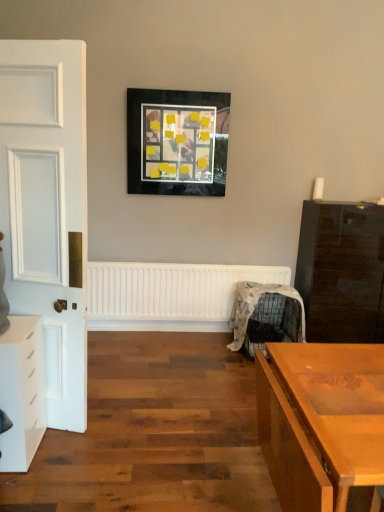
Question: From a real-world perspective, is glossy dark wood chest of drawers at right, which is counted as the second chest of drawers, starting from the front, over matte black picture frame at upper center?

Choices:
 (A) no
 (B) yes

Answer: (A)

Question: Is glossy dark wood chest of drawers at right, which ranks as the 1th chest of drawers in right-to-left order, facing towards matte black picture frame at upper center?

Choices:
 (A) yes
 (B) no

Answer: (B)

Question: Is glossy dark wood chest of drawers at right, which is the first chest of drawers from back to front, to the left of matte black picture frame at upper center from the viewer's perspective?

Choices:
 (A) no
 (B) yes

Answer: (A)

Question: Considering the relative sizes of glossy dark wood chest of drawers at right, which is counted as the second chest of drawers, starting from the front, and matte black picture frame at upper center in the image provided, is glossy dark wood chest of drawers at right, which is counted as the second chest of drawers, starting from the front, smaller than matte black picture frame at upper center?

Choices:
 (A) no
 (B) yes

Answer: (A)

Question: Can you confirm if glossy dark wood chest of drawers at right, which ranks as the 1th chest of drawers in right-to-left order, is bigger than matte black picture frame at upper center?

Choices:
 (A) no
 (B) yes

Answer: (B)

Question: In terms of height, does white matte chest of drawers at left, the first chest of drawers in the front-to-back sequence, look taller or shorter compared to white matte radiator at center?

Choices:
 (A) tall
 (B) short

Answer: (A)

Question: Would you say white matte chest of drawers at left, which is the first chest of drawers from left to right, is to the left or to the right of white matte radiator at center in the picture?

Choices:
 (A) right
 (B) left

Answer: (B)

Question: From a real-world perspective, is white matte chest of drawers at left, which is the first chest of drawers from left to right, positioned above or below white matte radiator at center?

Choices:
 (A) below
 (B) above

Answer: (A)

Question: Is white matte chest of drawers at left, which is the first chest of drawers from left to right, bigger or smaller than white matte radiator at center?

Choices:
 (A) small
 (B) big

Answer: (A)

Question: Is matte black picture frame at upper center taller or shorter than white matte chest of drawers at left, the second chest of drawers viewed from the right?

Choices:
 (A) tall
 (B) short

Answer: (A)

Question: Is point (165, 185) closer or farther from the camera than point (29, 358)?

Choices:
 (A) farther
 (B) closer

Answer: (A)

Question: Relative to white matte chest of drawers at left, the first chest of drawers in the front-to-back sequence, is matte black picture frame at upper center in front or behind?

Choices:
 (A) front
 (B) behind

Answer: (B)

Question: From the image's perspective, is matte black picture frame at upper center above or below white matte chest of drawers at left, arranged as the second chest of drawers when viewed from the back?

Choices:
 (A) below
 (B) above

Answer: (B)

Question: Relative to metallic wire swivel chair at center-right, is white matte radiator at center in front or behind?

Choices:
 (A) front
 (B) behind

Answer: (B)

Question: From a real-world perspective, is white matte radiator at center above or below metallic wire swivel chair at center-right?

Choices:
 (A) above
 (B) below

Answer: (A)